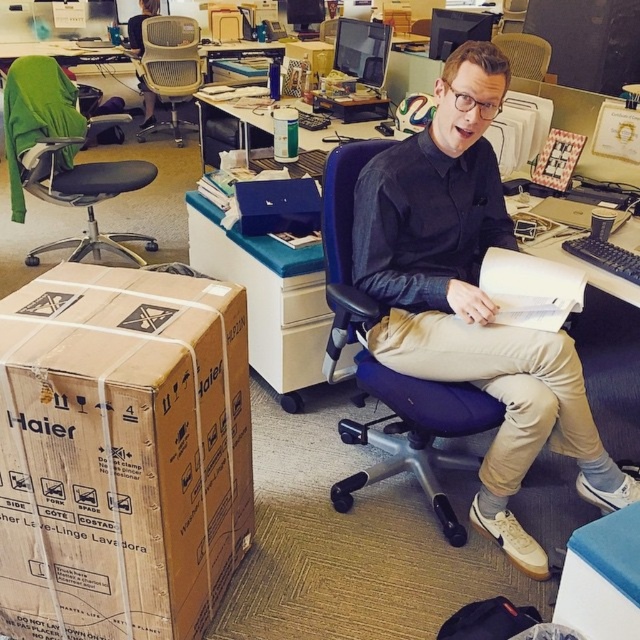
Which is more to the left, green fabric swivel chair at upper left or light beige mesh office chair at upper left?

light beige mesh office chair at upper left

Can you confirm if green fabric swivel chair at upper left is positioned above light beige mesh office chair at upper left?

No.

Is point (33, 115) positioned behind point (179, 60)?

No, (33, 115) is closer to viewer.

Find the location of `green fabric swivel chair at upper left`. green fabric swivel chair at upper left is located at coordinates (61, 157).

Does matte black shirt at center appear on the right side of light beige mesh office chair at upper left?

Correct, you'll find matte black shirt at center to the right of light beige mesh office chair at upper left.

Is matte black shirt at center taller than light beige mesh office chair at upper left?

Correct, matte black shirt at center is much taller as light beige mesh office chair at upper left.

Between point (433, 326) and point (145, 20), which one is positioned in front?

Point (433, 326)

What are the coordinates of `matte black shirt at center` in the screenshot? It's located at (472, 298).

The image size is (640, 640). Identify the location of brown cardboard box at lower left. (122, 452).

Is brown cardboard box at lower left to the left of light beige mesh office chair at upper left from the viewer's perspective?

In fact, brown cardboard box at lower left is to the right of light beige mesh office chair at upper left.

Between point (132, 582) and point (177, 99), which one is positioned behind?

The point (177, 99) is more distant.

Identify the location of brown cardboard box at lower left. Image resolution: width=640 pixels, height=640 pixels. (122, 452).